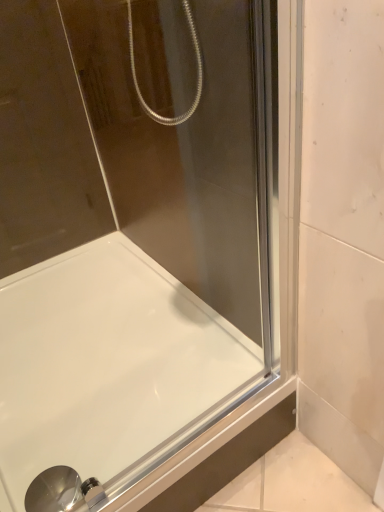
What do you see at coordinates (105, 362) in the screenshot? The height and width of the screenshot is (512, 384). I see `white glossy bathtub at lower left` at bounding box center [105, 362].

You are a GUI agent. You are given a task and a screenshot of the screen. Output one action in this format:
    pyautogui.click(x=<x>, y=<y>)
    Task: Click on the white glossy bathtub at lower left
    The height and width of the screenshot is (512, 384).
    Given the screenshot: What is the action you would take?
    pyautogui.click(x=105, y=362)

The width and height of the screenshot is (384, 512). Find the location of `white glossy bathtub at lower left`. white glossy bathtub at lower left is located at coordinates pyautogui.click(x=105, y=362).